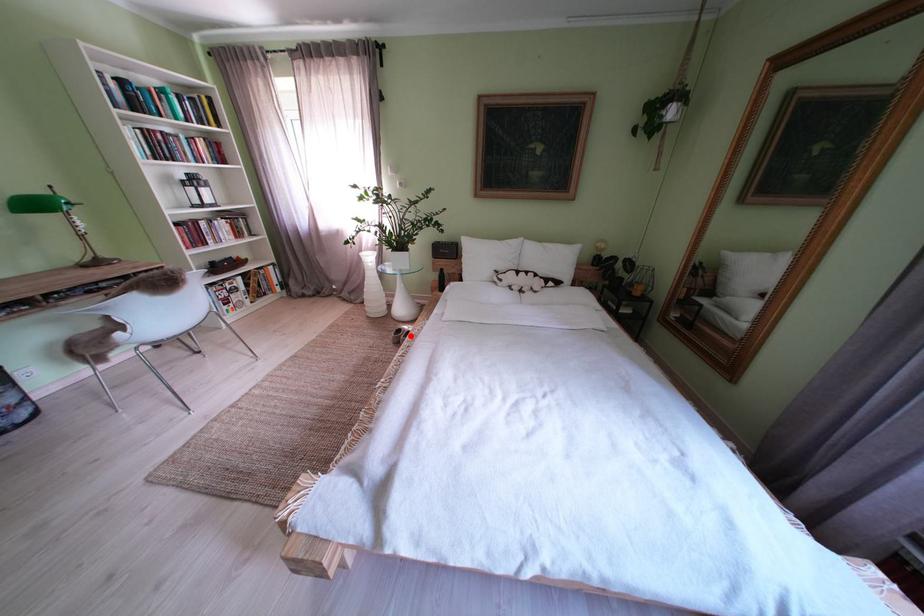
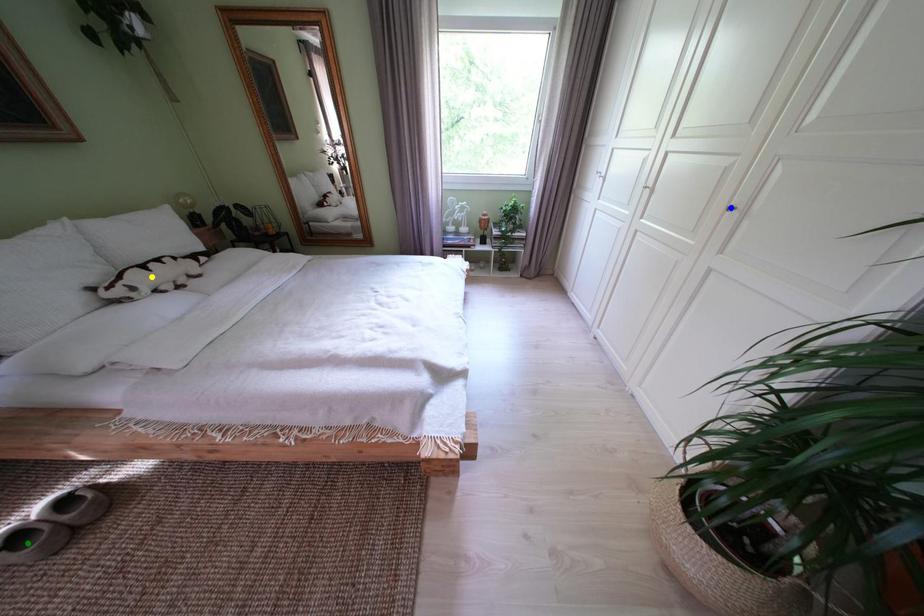
Question: I am providing you with two images of the same scene from different viewpoints. A red point is marked on the first image. You are given multiple points on the second image. Which spot in image 2 lines up with the point in image 1?

Choices:
 (A) blue point
 (B) green point
 (C) yellow point

Answer: (B)